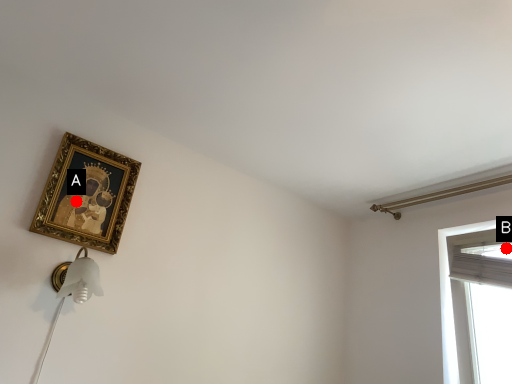
Question: Two points are circled on the image, labeled by A and B beside each circle. Which of the following is the closest to the observer?

Choices:
 (A) A is closer
 (B) B is closer

Answer: (A)